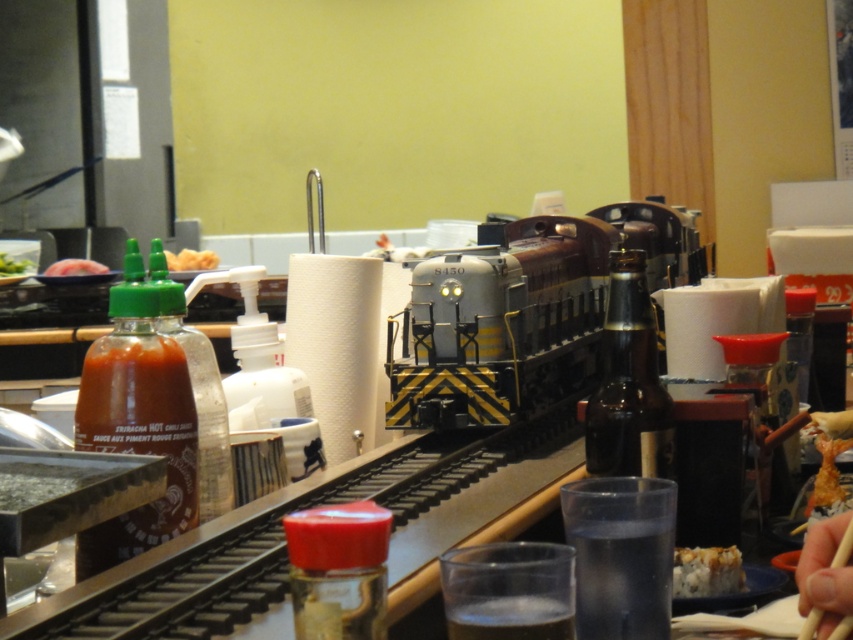
Question: Is clear plastic cup at center below matte black meat at left?

Choices:
 (A) yes
 (B) no

Answer: (A)

Question: Which is nearer to the yellow crumbly snack at center?

Choices:
 (A) matte black meat at left
 (B) matte glass bottle at left

Answer: (A)

Question: Among these points, which one is farthest from the camera?

Choices:
 (A) (183, 259)
 (B) (164, 442)
 (C) (646, 593)
 (D) (498, 602)

Answer: (A)

Question: Is brown glass bottle at center positioned before yellow crumbly snack at center?

Choices:
 (A) yes
 (B) no

Answer: (A)

Question: Is metallic silver train at center above green leafy vegetable at center?

Choices:
 (A) no
 (B) yes

Answer: (A)

Question: Which point is closer to the camera?

Choices:
 (A) (12, 275)
 (B) (836, 556)
 (C) (583, 572)

Answer: (B)